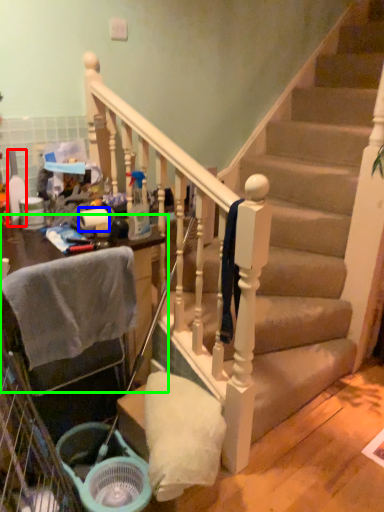
Question: Considering the real-world distances, which object is closest to bottle (highlighted by a red box)? toilet paper (highlighted by a blue box) or furniture (highlighted by a green box).

Choices:
 (A) toilet paper
 (B) furniture

Answer: (A)